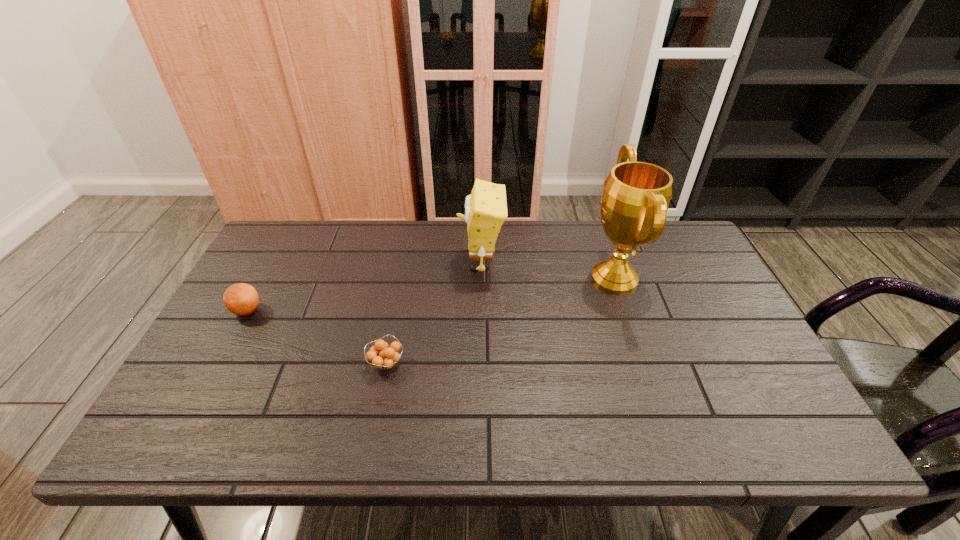
Identify the location of free location located 0.060m on the front-facing side of the tallest object. Image resolution: width=960 pixels, height=540 pixels. (565, 278).

Where is `free space located 0.120m on the face of the second tallest object`? This screenshot has width=960, height=540. free space located 0.120m on the face of the second tallest object is located at coordinates (420, 262).

At what (x,y) coordinates should I click in order to perform the action: click on free space located 0.330m on the face of the second tallest object. Please return your answer as a coordinate pair (x, y). This screenshot has width=960, height=540. Looking at the image, I should click on (351, 262).

Identify the location of blank space located 0.390m on the face of the second tallest object. point(332,262).

Identify the location of vacant space located 0.260m on the back of the farther orange fruit. (283, 244).

Find the location of a particular element. vacant space located 0.130m on the back of the shorter orange fruit is located at coordinates (396, 312).

Where is `award that is at the far edge`? award that is at the far edge is located at coordinates (636, 197).

Where is `sponge situated at the far edge`? The height and width of the screenshot is (540, 960). sponge situated at the far edge is located at coordinates (486, 208).

In order to click on object at the left edge in this screenshot , I will do `click(241, 299)`.

Image resolution: width=960 pixels, height=540 pixels. I want to click on vacant position at the far edge of the desktop, so click(x=556, y=262).